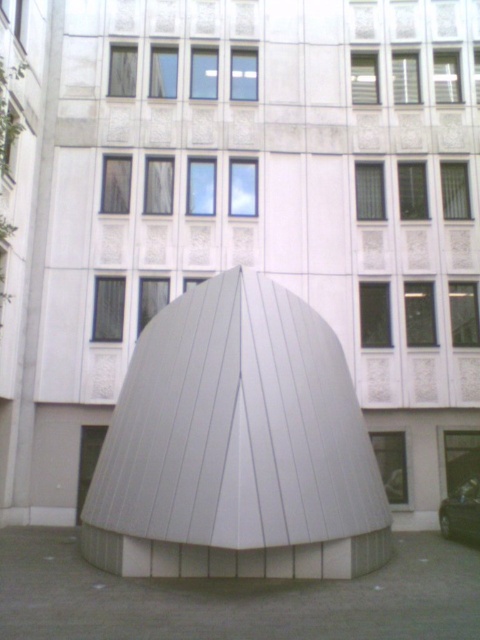
Question: Which point is closer to the camera taking this photo?

Choices:
 (A) (471, 492)
 (B) (195, 349)

Answer: (B)

Question: Observing the image, what is the correct spatial positioning of white smooth dome at center in reference to shiny black car at lower right?

Choices:
 (A) above
 (B) below

Answer: (A)

Question: Can you confirm if white smooth dome at center is positioned below shiny black car at lower right?

Choices:
 (A) no
 (B) yes

Answer: (A)

Question: In this image, where is white smooth dome at center located relative to shiny black car at lower right?

Choices:
 (A) below
 (B) above

Answer: (B)